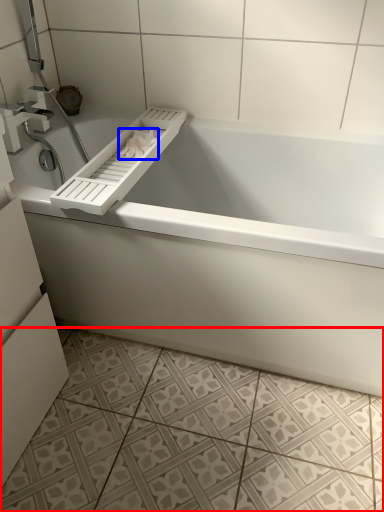
Question: Which of the following is the farthest to the observer, ceramic tile (highlighted by a red box) or toilet paper (highlighted by a blue box)?

Choices:
 (A) ceramic tile
 (B) toilet paper

Answer: (B)